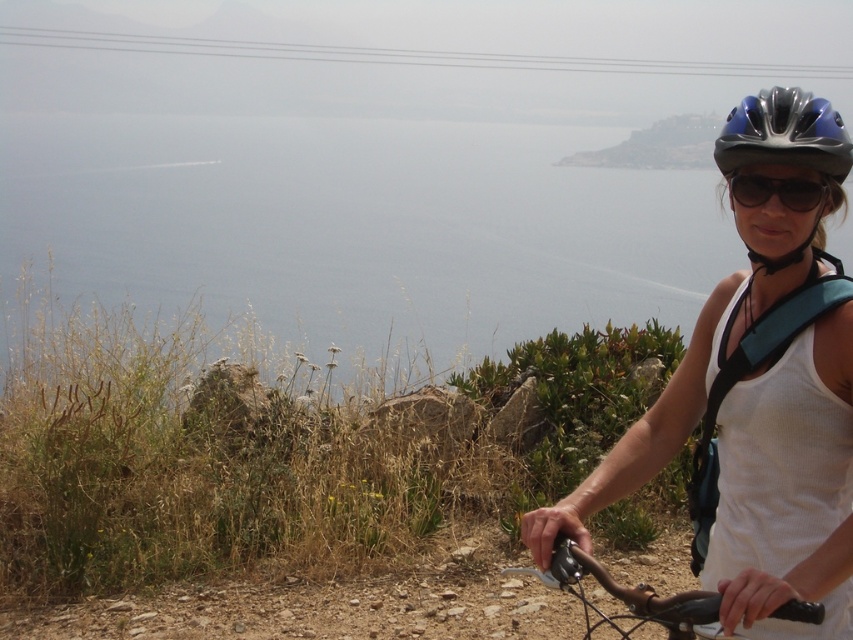
Does white fabric tank top at right appear under shiny metallic bicycle handlebars at lower right?

Incorrect, white fabric tank top at right is not positioned below shiny metallic bicycle handlebars at lower right.

In the scene shown: Who is higher up, white fabric tank top at right or shiny metallic bicycle handlebars at lower right?

white fabric tank top at right is higher up.

I want to click on white fabric tank top at right, so click(x=757, y=396).

Where is `white fabric tank top at right`? This screenshot has height=640, width=853. white fabric tank top at right is located at coordinates (757, 396).

Between white fabric tank top at right and black matte sunglasses at upper right, which one has less height?

black matte sunglasses at upper right is shorter.

Between white fabric tank top at right and black matte sunglasses at upper right, which one appears on the left side from the viewer's perspective?

white fabric tank top at right

Who is more forward, (758,408) or (819,198)?

Point (819,198)

Where is `white fabric tank top at right`? Image resolution: width=853 pixels, height=640 pixels. white fabric tank top at right is located at coordinates (757, 396).

Could you measure the distance between blue matte bicycle helmet at upper right and shiny metallic bicycle handlebars at lower right?

blue matte bicycle helmet at upper right is 31.35 inches away from shiny metallic bicycle handlebars at lower right.

What do you see at coordinates (784, 132) in the screenshot? The width and height of the screenshot is (853, 640). I see `blue matte bicycle helmet at upper right` at bounding box center [784, 132].

Is point (802, 97) farther from camera compared to point (659, 609)?

Yes, it is.

Find the location of a particular element. This screenshot has width=853, height=640. blue matte bicycle helmet at upper right is located at coordinates (784, 132).